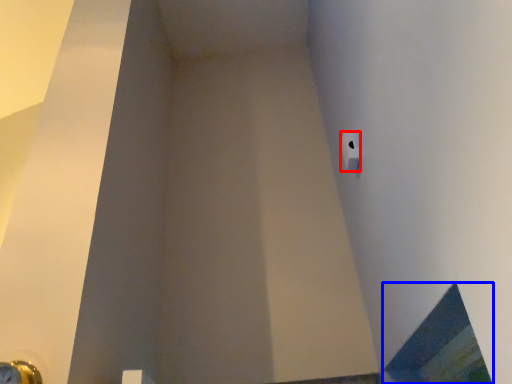
Question: Among these objects, which one is farthest to the camera, toilet paper (highlighted by a red box) or window (highlighted by a blue box)?

Choices:
 (A) toilet paper
 (B) window

Answer: (A)